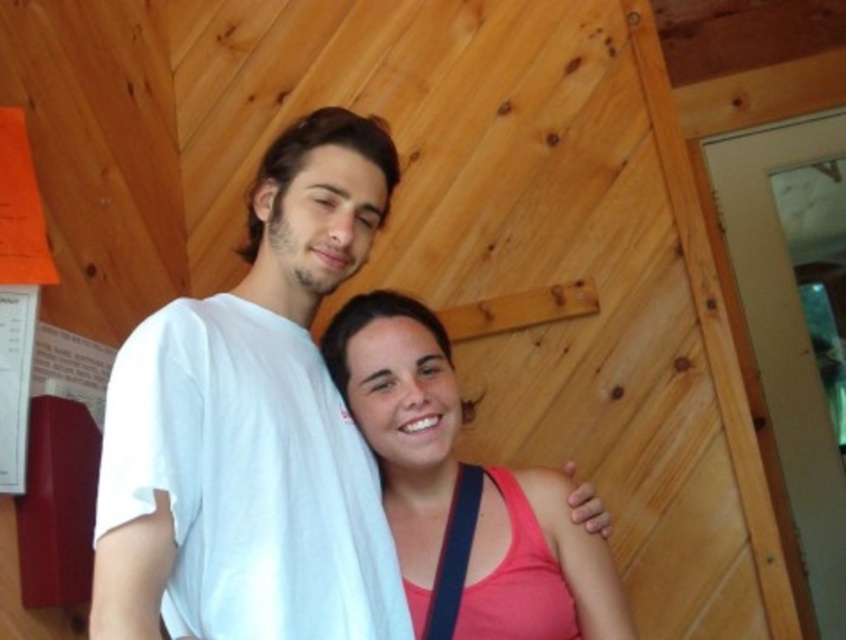
Question: Is white cotton shirt at center bigger than pink matte tank top at center?

Choices:
 (A) yes
 (B) no

Answer: (A)

Question: Is white cotton shirt at center closer to the viewer compared to pink matte tank top at center?

Choices:
 (A) no
 (B) yes

Answer: (B)

Question: Which point appears closest to the camera in this image?

Choices:
 (A) (452, 616)
 (B) (195, 628)

Answer: (B)

Question: Can you confirm if white cotton shirt at center is positioned to the right of pink matte tank top at center?

Choices:
 (A) no
 (B) yes

Answer: (A)